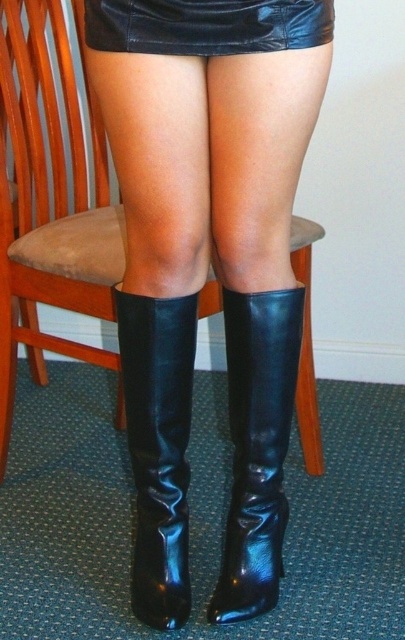
Looking at this image, measure the distance between shiny black boot at center and camera.

shiny black boot at center is 4.20 feet from camera.

This screenshot has width=405, height=640. Identify the location of shiny black boot at center. (257, 445).

Which is behind, point (259, 508) or point (249, 24)?

The point (259, 508) is behind.

Locate an element on the screen. The image size is (405, 640). shiny black boot at center is located at coordinates (257, 445).

Is shiny black boot at lower center below black leather skirt at upper center?

Yes.

Where is `shiny black boot at lower center`? The image size is (405, 640). shiny black boot at lower center is located at coordinates (159, 448).

Is wooden chair at center closer to the viewer compared to shiny black boot at lower center?

No, wooden chair at center is further to the viewer.

What do you see at coordinates (49, 196) in the screenshot? I see `wooden chair at center` at bounding box center [49, 196].

At what (x,y) coordinates should I click in order to perform the action: click on wooden chair at center. Please return your answer as a coordinate pair (x, y). Looking at the image, I should click on (49, 196).